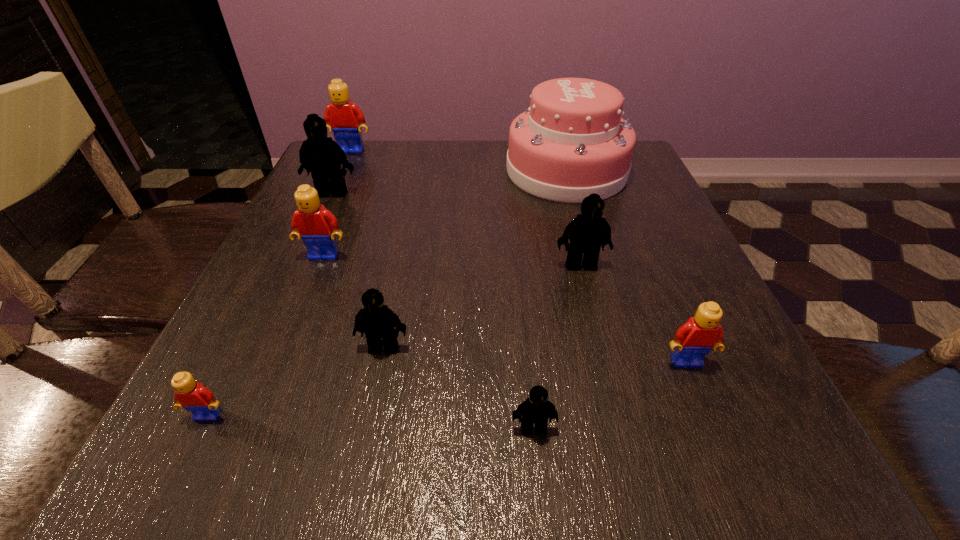
You are a GUI agent. You are given a task and a screenshot of the screen. Output one action in this format:
    pyautogui.click(x=<x>, y=<y>)
    Task: Click on the rightmost yellow Lego
    The height and width of the screenshot is (540, 960).
    Given the screenshot: What is the action you would take?
    pyautogui.click(x=693, y=340)

Image resolution: width=960 pixels, height=540 pixels. I want to click on the second nearest yellow Lego, so click(x=693, y=340).

Where is `the third Lego from right to left`? The image size is (960, 540). the third Lego from right to left is located at coordinates (536, 409).

Find the location of a particular element. This screenshot has width=960, height=540. the smallest black Lego is located at coordinates (536, 409).

You are a GUI agent. You are given a task and a screenshot of the screen. Output one action in this format:
    pyautogui.click(x=<x>, y=<y>)
    Task: Click on the nearest yellow Lego
    The image size is (960, 540).
    Given the screenshot: What is the action you would take?
    pyautogui.click(x=193, y=396)

You are a GUI agent. You are given a task and a screenshot of the screen. Output one action in this format:
    pyautogui.click(x=<x>, y=<y>)
    Task: Click on the vacant space located on the left of the cake
    This screenshot has height=540, width=960.
    Given the screenshot: What is the action you would take?
    pyautogui.click(x=396, y=171)

Find the location of a particular element. Image resolution: width=960 pixels, height=540 pixels. free space located on the face of the biggest black Lego is located at coordinates pyautogui.click(x=299, y=267).

Locate an element on the screen. The height and width of the screenshot is (540, 960). vacant space situated 0.330m on the front-facing side of the biggest yellow Lego is located at coordinates pos(314,234).

The image size is (960, 540). Find the location of `free region located 0.200m on the face of the rightmost black Lego`. free region located 0.200m on the face of the rightmost black Lego is located at coordinates (605, 362).

The width and height of the screenshot is (960, 540). Find the location of `vacant region located on the front-facing side of the second farthest yellow Lego`. vacant region located on the front-facing side of the second farthest yellow Lego is located at coordinates (252, 440).